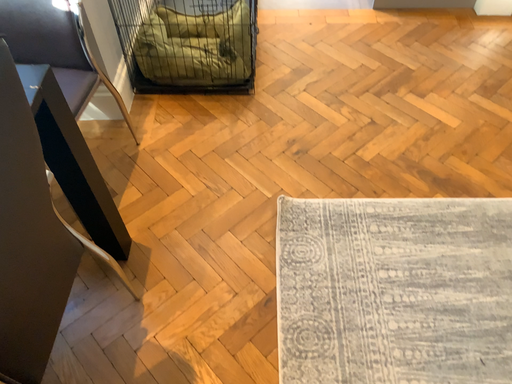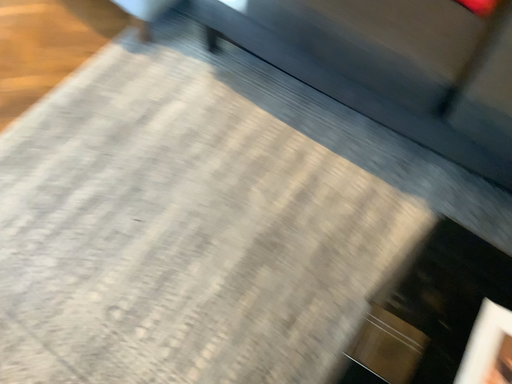
Question: Which way did the camera rotate in the video?

Choices:
 (A) rotated upward
 (B) rotated downward

Answer: (A)